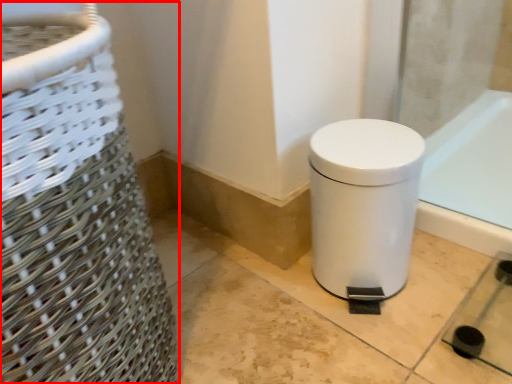
Question: In this image, where is basket container (annotated by the red box) located relative to waste container?

Choices:
 (A) right
 (B) left

Answer: (B)